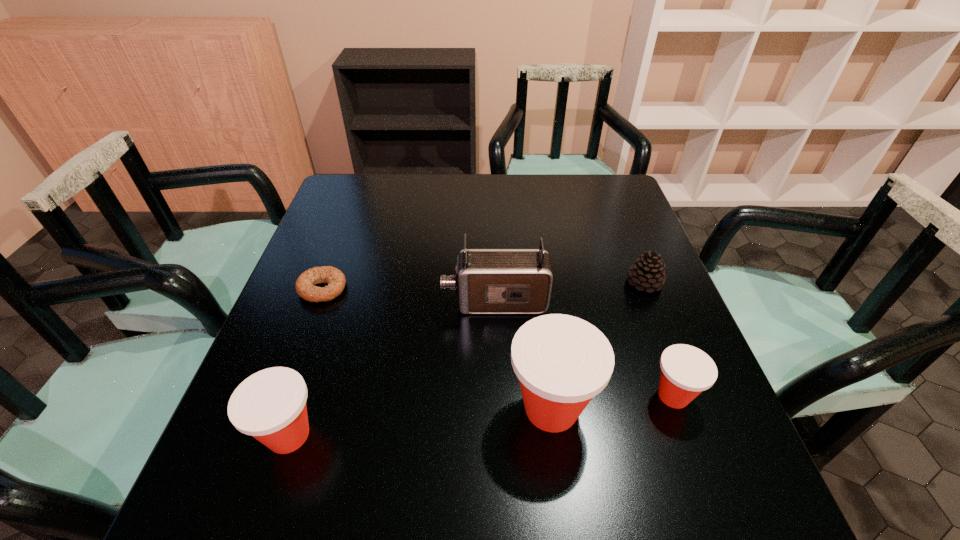
The width and height of the screenshot is (960, 540). I want to click on the third tallest object, so 270,405.

The image size is (960, 540). What are the coordinates of `the second tallest Dixie cup` in the screenshot? It's located at (270, 405).

At what (x,y) coordinates should I click in order to perform the action: click on the second Dixie cup from left to right. Please return your answer as a coordinate pair (x, y). The width and height of the screenshot is (960, 540). Looking at the image, I should click on (562, 362).

At what (x,y) coordinates should I click in order to perform the action: click on the rightmost Dixie cup. Please return your answer as a coordinate pair (x, y). Looking at the image, I should click on (686, 371).

Find the location of a particular element. camcorder is located at coordinates (488, 281).

I want to click on pinecone, so click(648, 272).

Find the location of a particular element. bagel is located at coordinates (304, 285).

You are a GUI agent. You are given a task and a screenshot of the screen. Output one action in this format:
    pyautogui.click(x=<x>, y=<y>)
    Task: Click on the free space located on the right of the second tallest Dixie cup
    
    Given the screenshot: What is the action you would take?
    pyautogui.click(x=486, y=435)

What are the coordinates of `vacant area located on the left of the second Dixie cup from left to right` in the screenshot? It's located at (361, 408).

Where is `vacant space positioned 0.260m on the left of the rightmost Dixie cup`? vacant space positioned 0.260m on the left of the rightmost Dixie cup is located at coordinates 516,396.